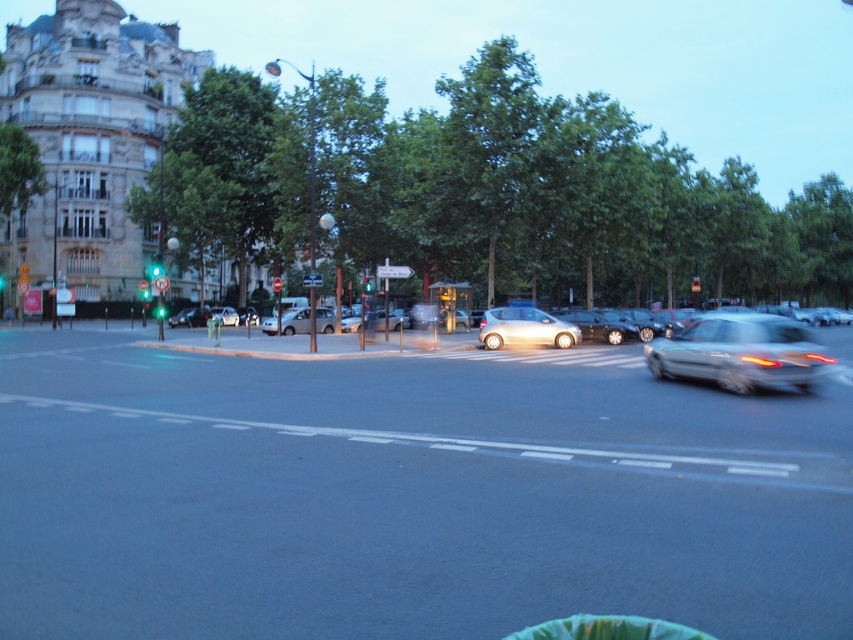
You are a pedestrian waiting at the crosswalk near the green glass traffic light at center. A silver metallic car at right is approaching. Given that the crosswalk is 20 feet long, can you safely cross before the car reaches the crosswalk?

The silver metallic car at right is 70.01 feet away from the green glass traffic light at center. Since the crosswalk is 20 feet long, the car is still 70.01 feet away from the crosswalk, so you have enough time to safely cross before the car arrives.